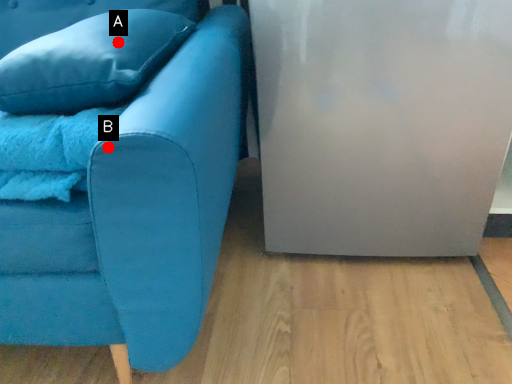
Question: Two points are circled on the image, labeled by A and B beside each circle. Which point is closer to the camera?

Choices:
 (A) A is closer
 (B) B is closer

Answer: (B)